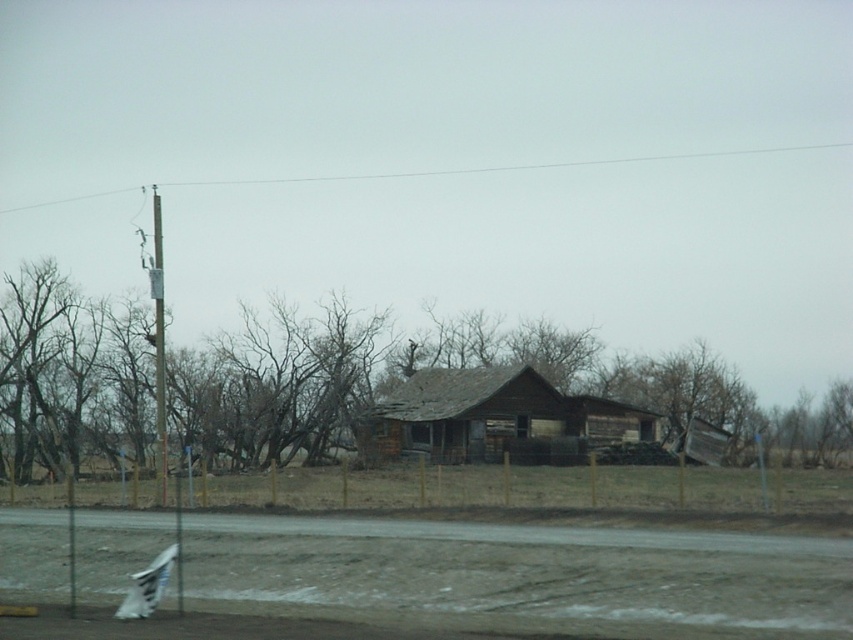
Can you confirm if brown wooden fence at center is wider than smooth gray pole at left?

Correct, the width of brown wooden fence at center exceeds that of smooth gray pole at left.

What do you see at coordinates (444, 369) in the screenshot?
I see `brown wooden fence at center` at bounding box center [444, 369].

You are a GUI agent. You are given a task and a screenshot of the screen. Output one action in this format:
    pyautogui.click(x=<x>, y=<y>)
    Task: Click on the brown wooden fence at center
    The height and width of the screenshot is (640, 853).
    Given the screenshot: What is the action you would take?
    pyautogui.click(x=444, y=369)

Measure the distance between brown wooden fence at center and weathered wood hut at center.

brown wooden fence at center is 5.46 meters away from weathered wood hut at center.

Does brown wooden fence at center have a smaller size compared to weathered wood hut at center?

Actually, brown wooden fence at center might be larger than weathered wood hut at center.

Is point (341, 326) farther from camera compared to point (517, 364)?

Yes, it is behind point (517, 364).

This screenshot has height=640, width=853. I want to click on brown wooden fence at center, so click(x=444, y=369).

Which is more to the left, weathered wood hut at center or smooth gray pole at left?

Positioned to the left is smooth gray pole at left.

Which is behind, point (433, 380) or point (155, 381)?

The point (433, 380) is behind.

At what (x,y) coordinates should I click in order to perform the action: click on weathered wood hut at center. Please return your answer as a coordinate pair (x, y). The width and height of the screenshot is (853, 640). Looking at the image, I should click on (494, 419).